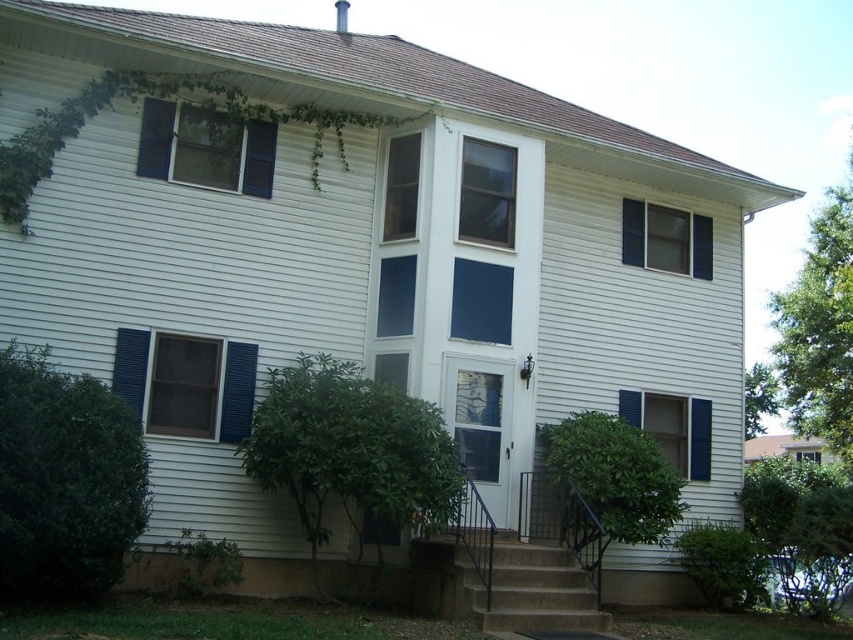
Who is positioned more to the left, matte blue shutters at left or blue matte window at upper center?

Positioned to the left is matte blue shutters at left.

Between matte blue shutters at left and blue matte window at upper center, which one has more height?

matte blue shutters at left is taller.

Is point (221, 438) closer to viewer compared to point (247, 166)?

Yes, it is.

The width and height of the screenshot is (853, 640). I want to click on matte blue shutters at left, so click(183, 385).

Is point (231, 413) more distant than point (473, 224)?

No, (231, 413) is closer to viewer.

Does matte blue shutters at left appear over clear glass window at center?

Actually, matte blue shutters at left is below clear glass window at center.

Image resolution: width=853 pixels, height=640 pixels. What are the coordinates of `matte blue shutters at left` in the screenshot? It's located at (183, 385).

How much distance is there between matte blue shutters at left and blue painted wood window at upper right?

matte blue shutters at left and blue painted wood window at upper right are 6.63 meters apart.

Who is more distant from viewer, [177,372] or [628,253]?

Positioned behind is point [628,253].

Identify the location of matte blue shutters at left. This screenshot has width=853, height=640. (183, 385).